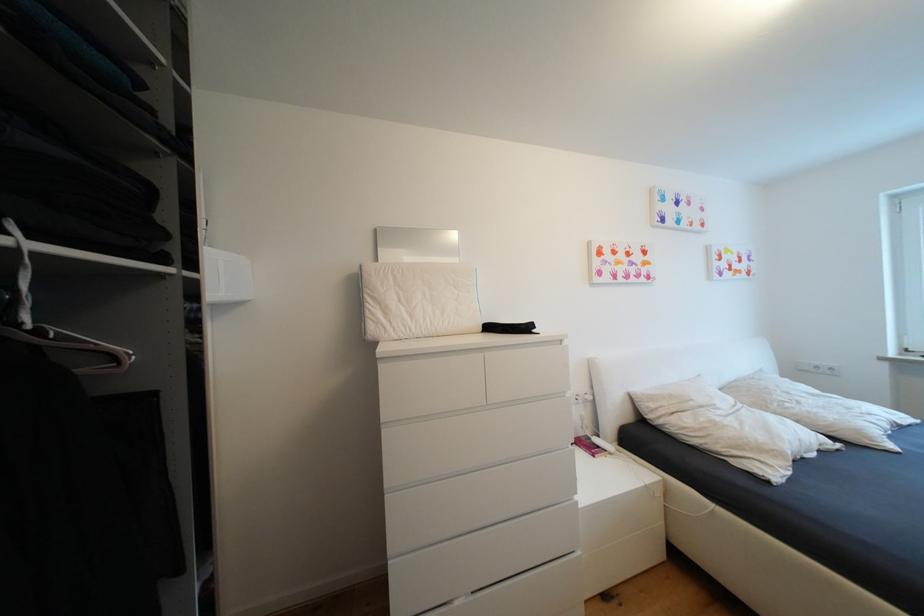
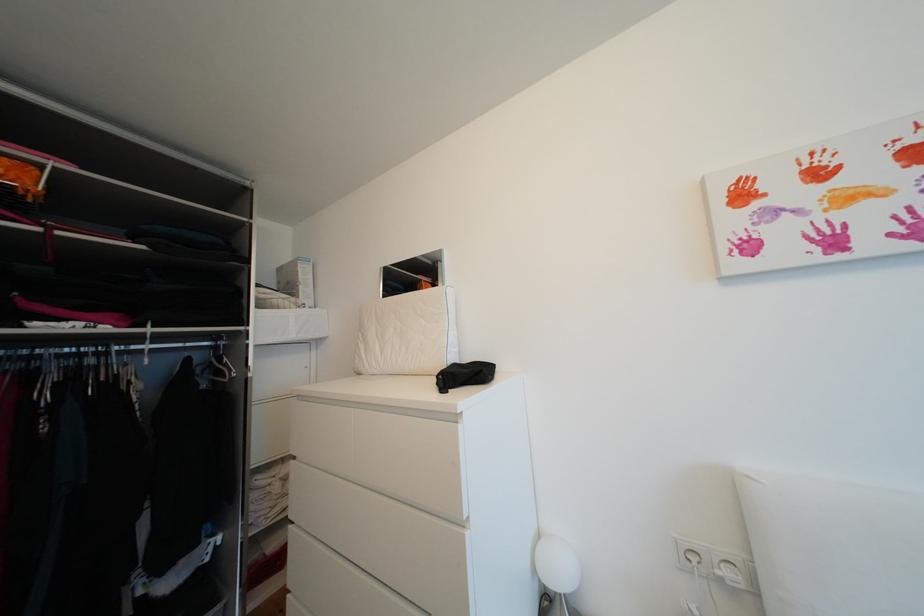
The point at (385, 325) is marked in the first image. Where is the corresponding point in the second image?

(368, 359)